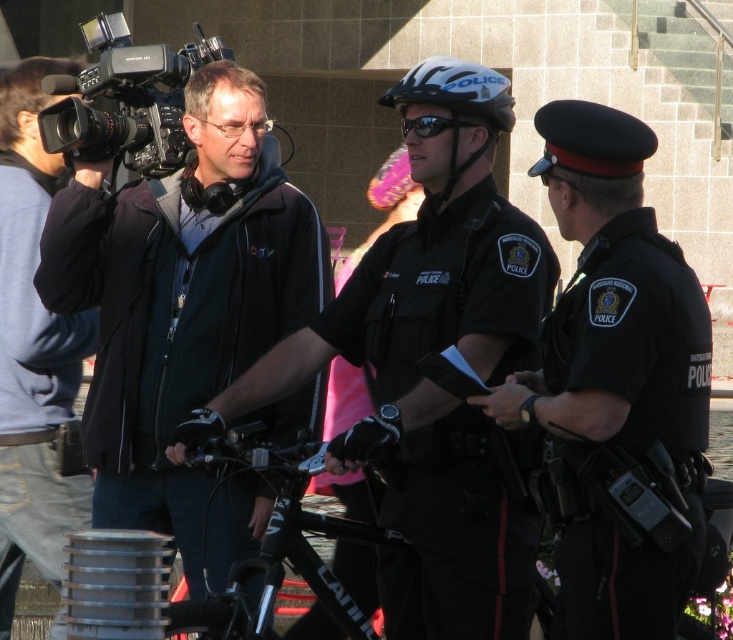
Does black matte jacket at left appear under dark blue uniform at center?

Correct, black matte jacket at left is located below dark blue uniform at center.

Does black matte jacket at left appear on the left side of dark blue uniform at center?

Indeed, black matte jacket at left is positioned on the left side of dark blue uniform at center.

Who is more distant from viewer, (497, 324) or (607, 538)?

Positioned behind is point (497, 324).

Locate an element on the screen. This screenshot has height=640, width=733. black matte jacket at left is located at coordinates (430, 385).

Is black matte jacket at left to the right of matte black jacket at center from the viewer's perspective?

Yes, black matte jacket at left is to the right of matte black jacket at center.

Image resolution: width=733 pixels, height=640 pixels. What do you see at coordinates (430, 385) in the screenshot?
I see `black matte jacket at left` at bounding box center [430, 385].

This screenshot has width=733, height=640. What do you see at coordinates (430, 385) in the screenshot?
I see `black matte jacket at left` at bounding box center [430, 385].

Locate an element on the screen. This screenshot has height=640, width=733. black matte jacket at left is located at coordinates (430, 385).

Which is in front, point (51, 161) or point (468, 96)?

Point (468, 96) is in front.

Who is shorter, matte black camera at left or white matte bicycle helmet at center?

white matte bicycle helmet at center

Between point (10, 605) and point (478, 77), which one is positioned in front?

Positioned in front is point (478, 77).

Where is `matte black camera at left`? matte black camera at left is located at coordinates (33, 348).